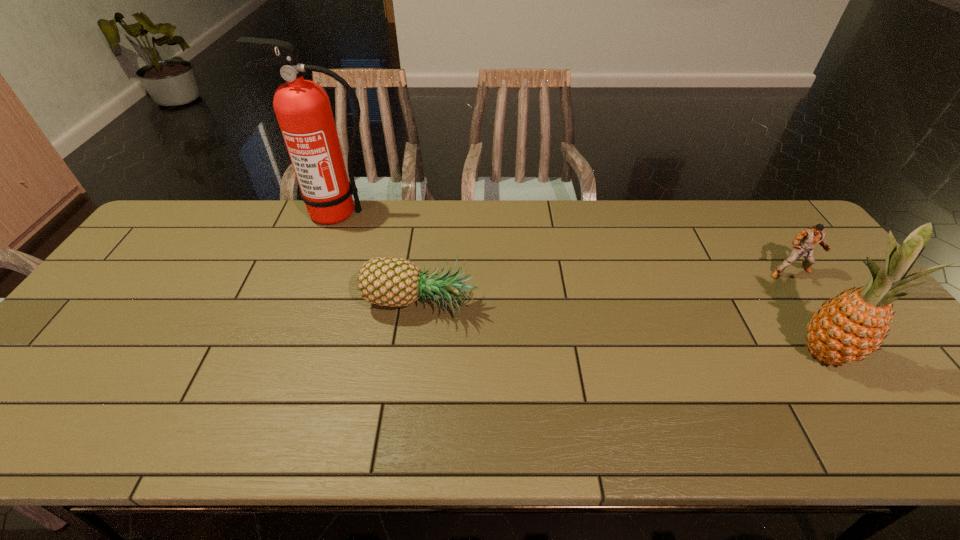
Image resolution: width=960 pixels, height=540 pixels. Find the location of `free area in between the second farthest object and the leftmost object`. free area in between the second farthest object and the leftmost object is located at coordinates (564, 243).

The width and height of the screenshot is (960, 540). I want to click on free space that is in between the third shortest object and the third object from right to left, so click(622, 330).

Find the location of a particular element. The image size is (960, 540). free space between the third nearest object and the farthest object is located at coordinates (564, 243).

This screenshot has width=960, height=540. Identify the location of empty space between the tallest object and the right pineapple. (581, 284).

Locate an element on the screen. The height and width of the screenshot is (540, 960). vacant point located between the taller pineapple and the shorter pineapple is located at coordinates tap(622, 330).

Find the location of `blank region between the farthest object and the puncher`. blank region between the farthest object and the puncher is located at coordinates (564, 243).

This screenshot has height=540, width=960. I want to click on vacant area that lies between the third shortest object and the second object from left to right, so click(622, 330).

You are a GUI agent. You are given a task and a screenshot of the screen. Output one action in this format:
    pyautogui.click(x=<x>, y=<y>)
    Task: Click on the free space between the third object from right to left and the right pineapple
    The image size is (960, 540).
    Given the screenshot: What is the action you would take?
    pyautogui.click(x=622, y=330)

You are a GUI agent. You are given a task and a screenshot of the screen. Output one action in this format:
    pyautogui.click(x=<x>, y=<y>)
    Task: Click on the object that is the second closest to the third shortest object
    The width and height of the screenshot is (960, 540).
    Given the screenshot: What is the action you would take?
    pyautogui.click(x=383, y=281)

Identify which object is located as the second nearest to the second tallest object. Please provide its 2D coordinates. Your answer should be formatted as a tuple, i.e. [(x, y)], where the tuple contains the x and y coordinates of a point satisfying the conditions above.

[(383, 281)]